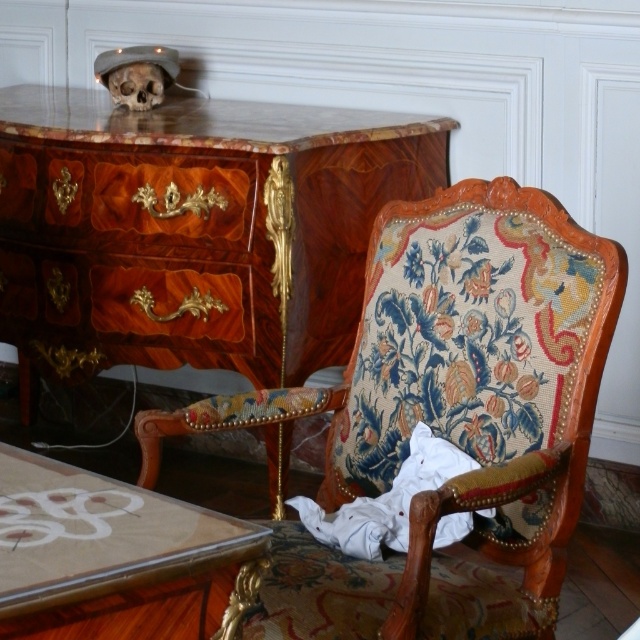
Can you confirm if marble top dresser at left is bigger than bone-like skull at upper left?

Yes, marble top dresser at left is bigger than bone-like skull at upper left.

You are a GUI agent. You are given a task and a screenshot of the screen. Output one action in this format:
    pyautogui.click(x=<x>, y=<y>)
    Task: Click on the marble top dresser at left
    
    Given the screenshot: What is the action you would take?
    pyautogui.click(x=195, y=228)

Is point (321, 189) positioned before point (136, 97)?

Yes, it is in front of point (136, 97).

Locate an element on the screen. The image size is (640, 640). marble top dresser at left is located at coordinates (195, 228).

Does marble top dresser at left appear on the right side of translucent glass table at lower left?

Correct, you'll find marble top dresser at left to the right of translucent glass table at lower left.

Between point (48, 246) and point (84, 538), which one is positioned in front?

Positioned in front is point (84, 538).

Where is `marble top dresser at left`? This screenshot has height=640, width=640. marble top dresser at left is located at coordinates (195, 228).

Is point (147, 452) closer to camera compared to point (134, 65)?

Yes, it is in front of point (134, 65).

The width and height of the screenshot is (640, 640). What do you see at coordinates (460, 380) in the screenshot?
I see `wooden armchair with floral upholstery at center` at bounding box center [460, 380].

Does point (566, 392) come behind point (170, 83)?

No.

Identify the location of wooden armchair with floral upholstery at center. (460, 380).